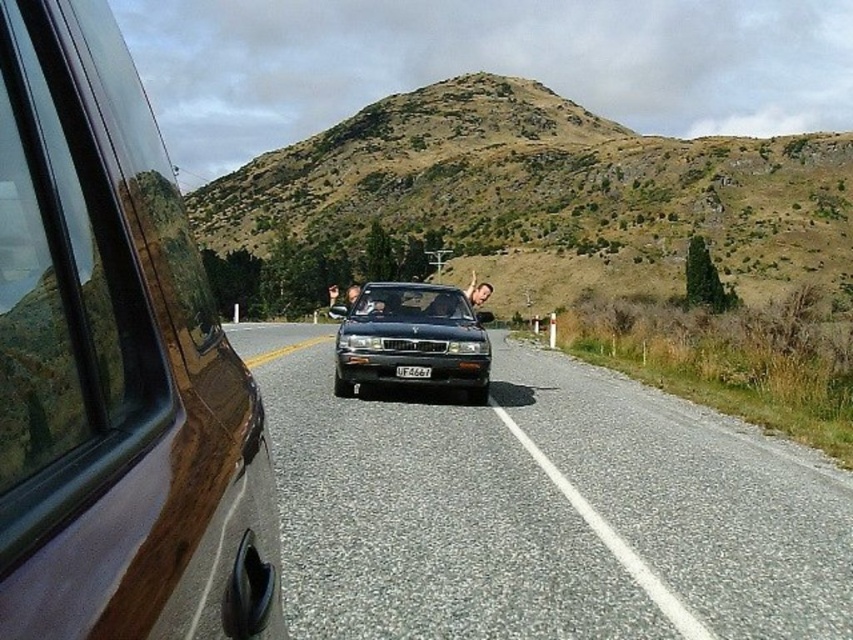
Question: Does black asphalt road at center appear on the right side of black glossy sedan at center?

Choices:
 (A) yes
 (B) no

Answer: (A)

Question: Which object appears closest to the camera in this image?

Choices:
 (A) black glossy sedan at center
 (B) brown matte suv at left

Answer: (B)

Question: From the image, what is the correct spatial relationship of brown matte suv at left in relation to black plastic license plate at center?

Choices:
 (A) below
 (B) above

Answer: (B)

Question: Is brown grassy hill at upper center above black plastic license plate at center?

Choices:
 (A) yes
 (B) no

Answer: (A)

Question: Based on their relative distances, which object is nearer to the black asphalt road at center?

Choices:
 (A) brown matte suv at left
 (B) brown grassy hill at upper center
 (C) black plastic license plate at center

Answer: (C)

Question: Which point is farther from the camera taking this photo?

Choices:
 (A) (648, 620)
 (B) (329, 300)
 (C) (1, 33)
 (D) (633, 266)

Answer: (D)